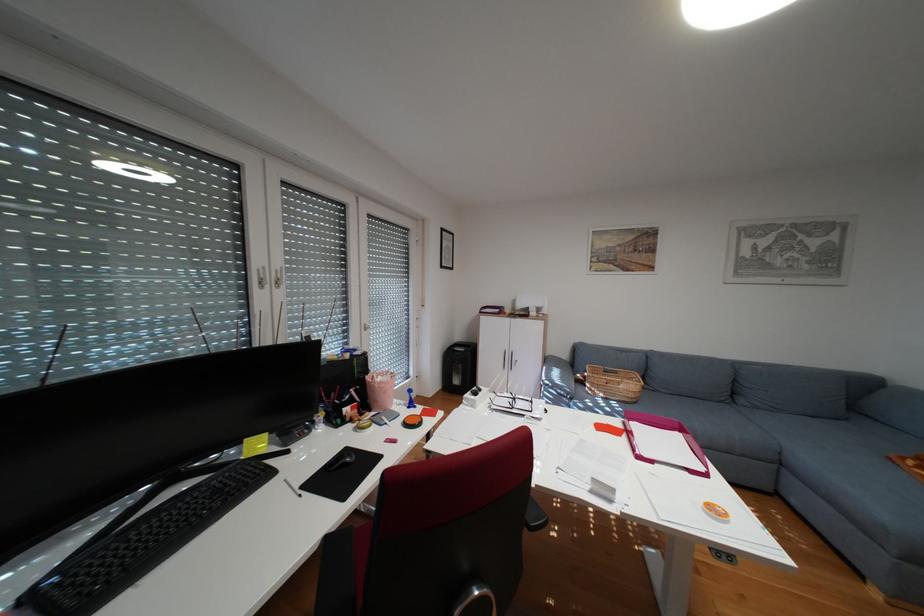
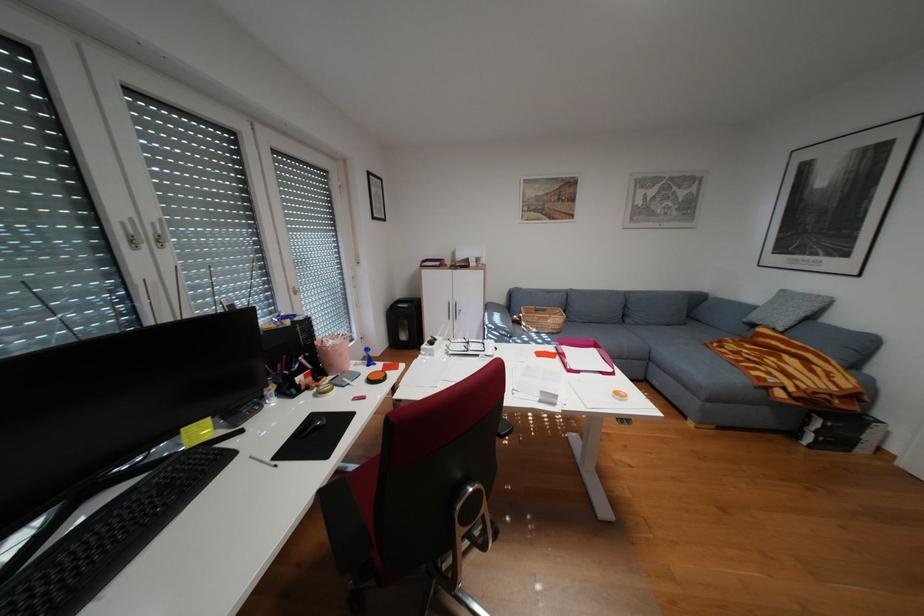
Question: The images are taken continuously from a first-person perspective. In which direction is your viewpoint rotating?

Choices:
 (A) Left
 (B) Right
 (C) Up
 (D) Down

Answer: (B)